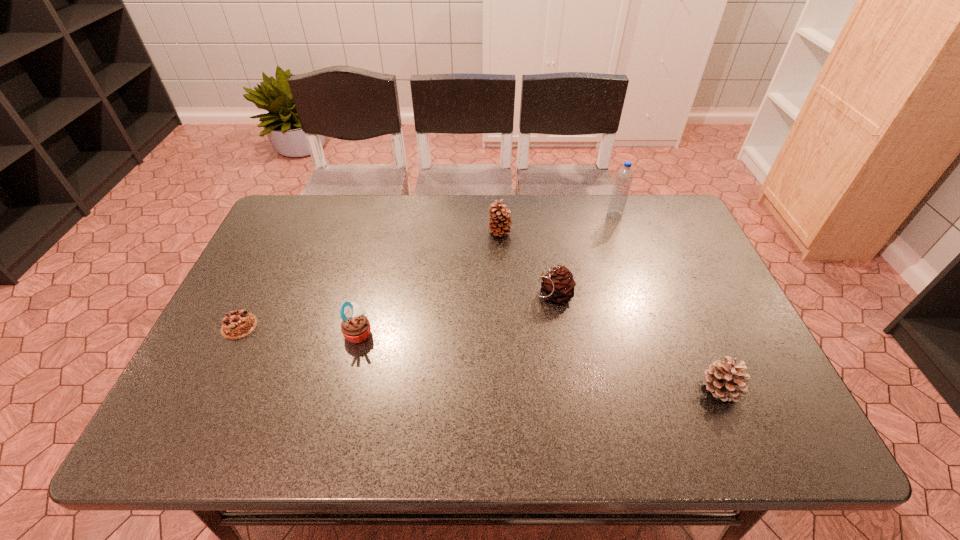
Where is `the shortest object`? the shortest object is located at coordinates (239, 323).

Locate an element on the screen. Image resolution: width=960 pixels, height=540 pixels. vacant space situated on the right of the fifth object from left to right is located at coordinates (657, 215).

At what (x,y) coordinates should I click in order to perform the action: click on vacant space located on the front of the leftmost pinecone. Please return your answer as a coordinate pair (x, y). The height and width of the screenshot is (540, 960). Looking at the image, I should click on (504, 313).

Where is `vacant space located 0.400m on the front-facing side of the muffin`? This screenshot has height=540, width=960. vacant space located 0.400m on the front-facing side of the muffin is located at coordinates (535, 333).

Where is `free space located 0.140m with a leaf charm attached to the second farthest pinecone`? The image size is (960, 540). free space located 0.140m with a leaf charm attached to the second farthest pinecone is located at coordinates (479, 294).

This screenshot has width=960, height=540. Find the location of `vacant area situated 0.270m with a leaf charm attached to the second farthest pinecone`. vacant area situated 0.270m with a leaf charm attached to the second farthest pinecone is located at coordinates (430, 294).

This screenshot has width=960, height=540. Find the location of `vacant space located with a leaf charm attached to the second farthest pinecone`. vacant space located with a leaf charm attached to the second farthest pinecone is located at coordinates [x=430, y=294].

Locate an element on the screen. Image resolution: width=960 pixels, height=540 pixels. vacant space situated on the left of the rightmost pinecone is located at coordinates (547, 389).

Where is `free space located 0.390m on the right of the leftmost object`? This screenshot has height=540, width=960. free space located 0.390m on the right of the leftmost object is located at coordinates 413,326.

The width and height of the screenshot is (960, 540). What are the coordinates of `water bottle located in the far edge section of the desktop` in the screenshot? It's located at (624, 176).